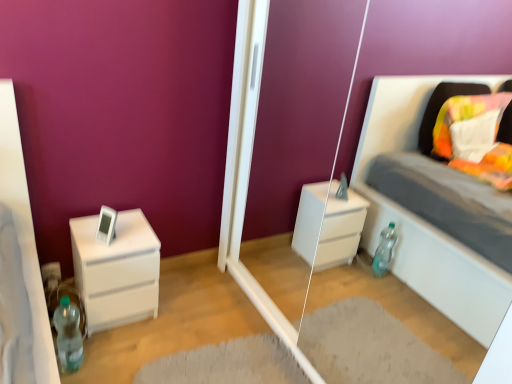
Question: From a real-world perspective, is white matte chest of drawers at left under translucent plastic bottle at lower left?

Choices:
 (A) yes
 (B) no

Answer: (B)

Question: Would you consider white matte chest of drawers at left to be distant from translucent plastic bottle at lower left?

Choices:
 (A) no
 (B) yes

Answer: (A)

Question: Is the position of white matte chest of drawers at left less distant than that of translucent plastic bottle at lower left?

Choices:
 (A) yes
 (B) no

Answer: (B)

Question: Can you confirm if white matte chest of drawers at left is positioned to the right of translucent plastic bottle at lower left?

Choices:
 (A) no
 (B) yes

Answer: (B)

Question: Is white matte chest of drawers at left positioned beyond the bounds of translucent plastic bottle at lower left?

Choices:
 (A) no
 (B) yes

Answer: (B)

Question: From the image's perspective, is white matte chest of drawers at left located above or below translucent plastic bottle at lower left?

Choices:
 (A) below
 (B) above

Answer: (B)

Question: Relative to translucent plastic bottle at lower left, is white matte chest of drawers at left in front or behind?

Choices:
 (A) front
 (B) behind

Answer: (B)

Question: Considering the relative positions of white matte chest of drawers at left and translucent plastic bottle at lower left in the image provided, is white matte chest of drawers at left to the left or to the right of translucent plastic bottle at lower left?

Choices:
 (A) right
 (B) left

Answer: (A)

Question: Looking at their shapes, would you say white matte chest of drawers at left is wider or thinner than translucent plastic bottle at lower left?

Choices:
 (A) thin
 (B) wide

Answer: (B)

Question: Does point (67, 364) appear closer or farther from the camera than point (84, 249)?

Choices:
 (A) closer
 (B) farther

Answer: (A)

Question: In the image, is translucent plastic bottle at lower left on the left side or the right side of white matte chest of drawers at left?

Choices:
 (A) right
 (B) left

Answer: (B)

Question: Which is correct: translucent plastic bottle at lower left is inside white matte chest of drawers at left, or outside of it?

Choices:
 (A) inside
 (B) outside

Answer: (B)

Question: Relative to white matte chest of drawers at left, is translucent plastic bottle at lower left in front or behind?

Choices:
 (A) front
 (B) behind

Answer: (A)

Question: From a real-world perspective, relative to white matte chest of drawers at left, is transparent glass door at center vertically above or below?

Choices:
 (A) above
 (B) below

Answer: (A)

Question: Relative to white matte chest of drawers at left, is transparent glass door at center in front or behind?

Choices:
 (A) front
 (B) behind

Answer: (A)